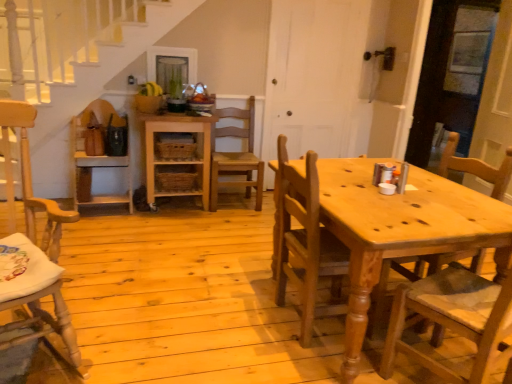
Locate an element on the screen. The image size is (512, 384). free location to the right of light brown wood chair at left, which is counted as the fourth chair, starting from the right is located at coordinates (150, 339).